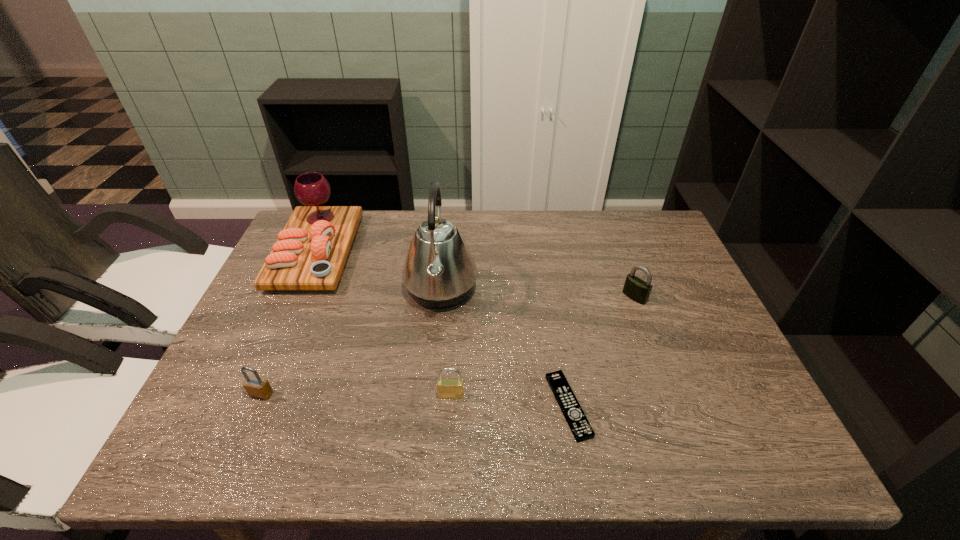
Locate an element on the screen. vacant region located on the back of the rightmost object is located at coordinates (627, 277).

The height and width of the screenshot is (540, 960). Identify the location of vacant area situated 0.050m on the front-facing side of the second padlock from left to right. (449, 420).

At what (x,y) coordinates should I click in order to perform the action: click on vacant space located 0.250m on the back of the leftmost padlock. Please return your answer as a coordinate pair (x, y). The image size is (960, 540). Looking at the image, I should click on (299, 306).

In order to click on free point located 0.220m on the left of the fifth object from left to right in this screenshot , I will do `click(445, 406)`.

This screenshot has height=540, width=960. I want to click on object at the far edge, so click(x=311, y=251).

Identify the location of object at the near edge. (579, 425).

Where is `platter located in the left edge section of the desktop`? The image size is (960, 540). platter located in the left edge section of the desktop is located at coordinates (311, 251).

At what (x,y) coordinates should I click in order to perform the action: click on padlock present at the left edge. Please return your answer as a coordinate pair (x, y). Image resolution: width=960 pixels, height=540 pixels. Looking at the image, I should click on (256, 386).

Find the location of a particular element. The height and width of the screenshot is (540, 960). object at the right edge is located at coordinates (636, 289).

Locate an element on the screen. Image resolution: width=960 pixels, height=540 pixels. object that is at the far left corner is located at coordinates (x=311, y=251).